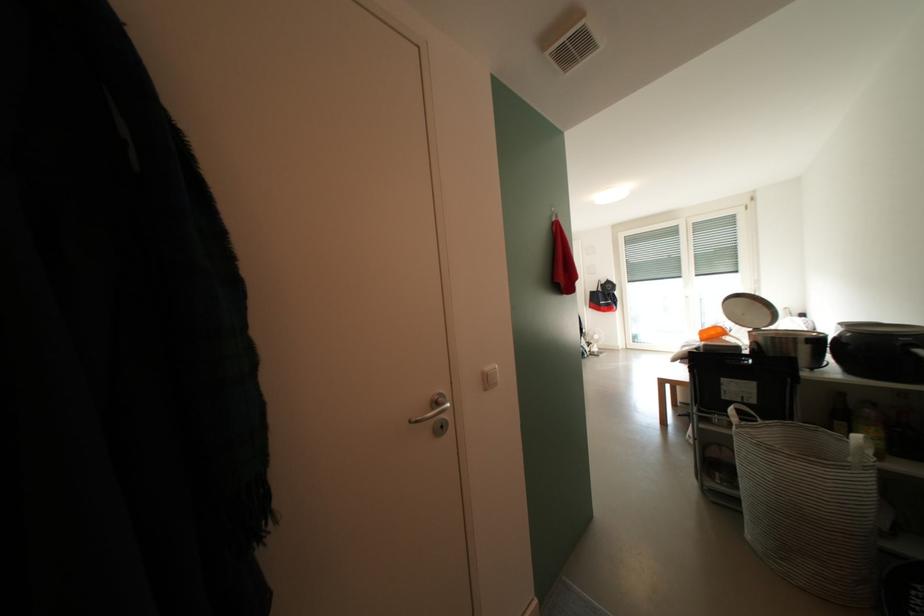
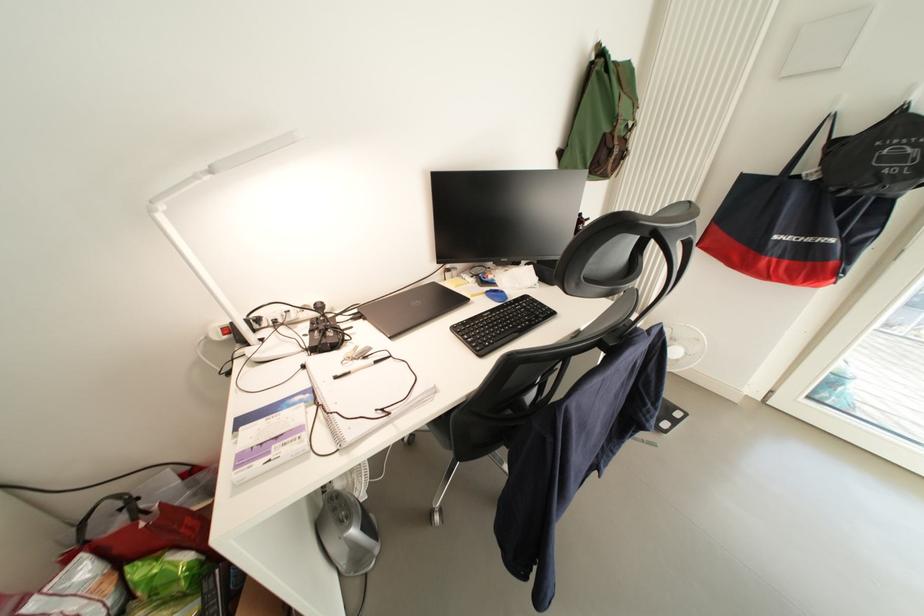
What movement of the cameraman would produce the second image?

The cameraman moved toward right, forward.